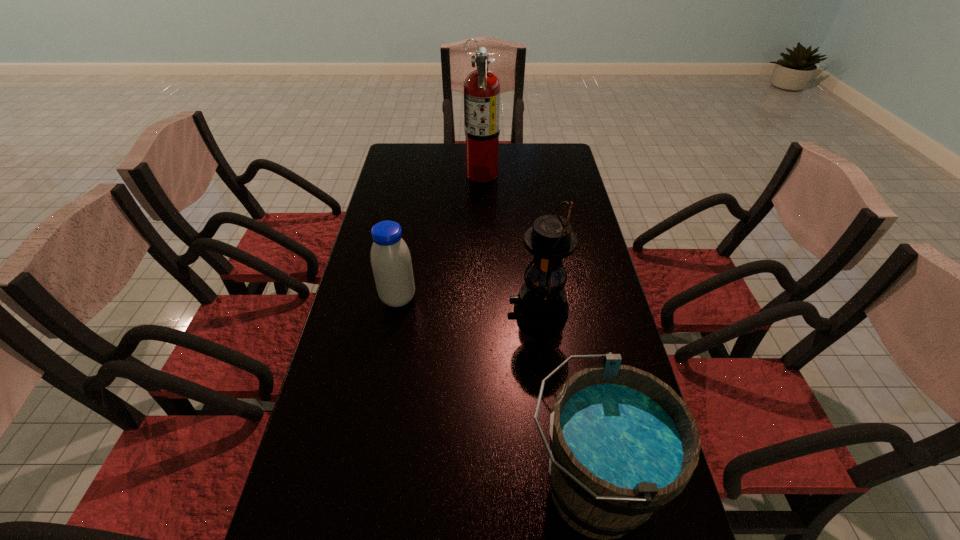
Identify the location of vacant space that's between the lantern and the second object from left to right. (511, 241).

I want to click on vacant area between the leftmost object and the third shortest object, so click(x=468, y=303).

Find the location of a particular element. empty space that is in between the lantern and the shortest object is located at coordinates (468, 303).

Locate which object is the second closest to the third object from right to left. Please provide its 2D coordinates. Your answer should be formatted as a tuple, i.e. [(x, y)], where the tuple contains the x and y coordinates of a point satisfying the conditions above.

[(541, 303)]

Image resolution: width=960 pixels, height=540 pixels. I want to click on object identified as the second closest to the nearest object, so click(x=391, y=263).

Where is `free space in the image that satisfies the following two spatial constraints: 1. on the nozzle side of the tallest object; 2. on the front side of the soya milk`? The height and width of the screenshot is (540, 960). free space in the image that satisfies the following two spatial constraints: 1. on the nozzle side of the tallest object; 2. on the front side of the soya milk is located at coordinates (483, 298).